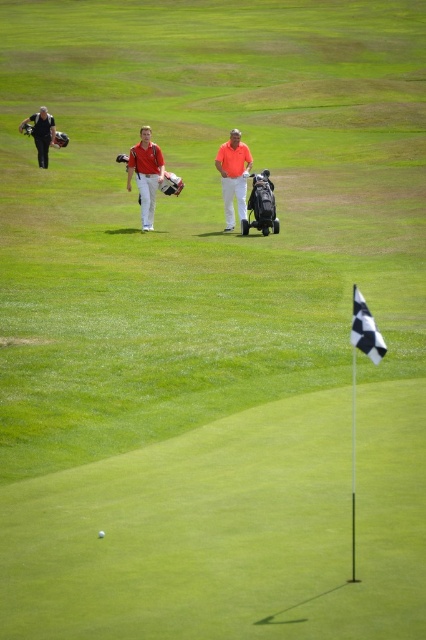
How distant is matte orange shirt at center from black checkered flag at center?

matte orange shirt at center is 11.56 meters from black checkered flag at center.

Which is more to the right, matte orange shirt at center or black checkered flag at center?

Positioned to the right is black checkered flag at center.

Is point (230, 132) closer to viewer compared to point (359, 310)?

No, (230, 132) is behind (359, 310).

Find the location of `matte orange shirt at center`. matte orange shirt at center is located at coordinates (233, 176).

You are a GUI agent. You are given a task and a screenshot of the screen. Output one action in this format:
    pyautogui.click(x=<x>, y=<y>)
    Task: Click on the matte orange shirt at center
    The image size is (426, 640).
    Given the screenshot: What is the action you would take?
    pyautogui.click(x=233, y=176)

Who is shorter, matte orange shirt at center or white matte golf ball at center?

white matte golf ball at center is shorter.

Is point (238, 195) positioned in front of point (103, 536)?

That is False.

Find the location of a particular element. This screenshot has height=640, width=426. matte orange shirt at center is located at coordinates (233, 176).

Which is more to the left, matte black golf bag at left or white matte golf ball at center?

matte black golf bag at left is more to the left.

Which is more to the right, matte black golf bag at left or white matte golf ball at center?

white matte golf ball at center is more to the right.

Find the location of a particular element. matte black golf bag at left is located at coordinates (40, 132).